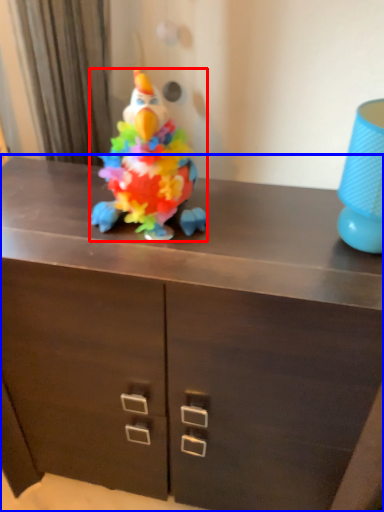
Question: Which object is further to the camera taking this photo, toy (highlighted by a red box) or chest of drawers (highlighted by a blue box)?

Choices:
 (A) toy
 (B) chest of drawers

Answer: (A)